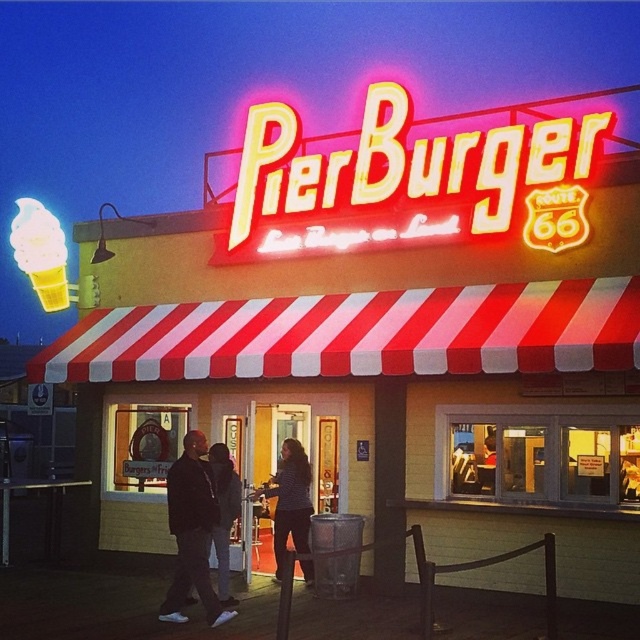
Is point (170, 509) more distant than point (284, 548)?

No.

Between point (214, 509) and point (280, 488), which one is positioned behind?

The point (280, 488) is more distant.

Locate an element on the screen. The width and height of the screenshot is (640, 640). dark gray pants at center is located at coordinates (192, 532).

Is red/white striped awning at center positioned behind dark gray pants at center?

No.

This screenshot has width=640, height=640. Describe the element at coordinates (358, 333) in the screenshot. I see `red/white striped awning at center` at that location.

Identify the location of red/white striped awning at center. This screenshot has height=640, width=640. (358, 333).

Does point (269, 173) come behind point (291, 444)?

Yes, point (269, 173) is behind point (291, 444).

Who is lower down, neon yellow sign at upper center or striped shirt at center?

striped shirt at center is below.

You are a GUI agent. You are given a task and a screenshot of the screen. Output one action in this format:
    pyautogui.click(x=<x>, y=<y>)
    Task: Click on the neon yellow sign at upper center
    This screenshot has height=640, width=640.
    Given the screenshot: What is the action you would take?
    pyautogui.click(x=404, y=163)